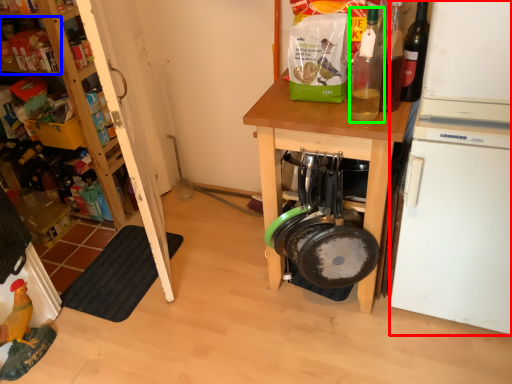
Question: Which object is positioned farthest from appliance (highlighted by a red box)? Select from shelf (highlighted by a blue box) and bottle (highlighted by a green box).

Choices:
 (A) shelf
 (B) bottle

Answer: (A)